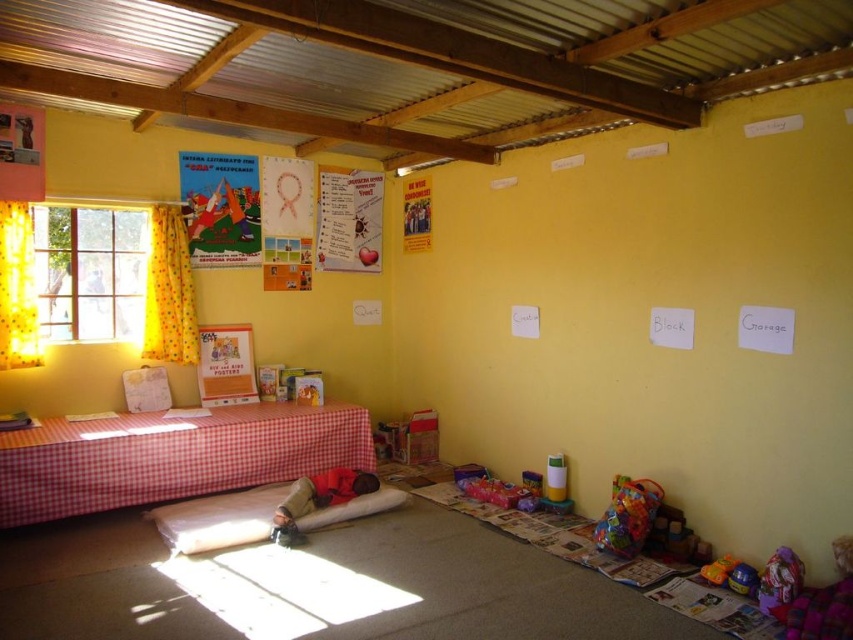
You are standing in the room and want to hang a new poster that is the same size as the taller object between the yellow fabric window at left and the multicolored fabric bag at lower right. Which object should you measure to ensure the poster fits properly?

The yellow fabric window at left is taller than the multicolored fabric bag at lower right, so you should measure the yellow fabric window at left to ensure the poster fits properly.

You are an interior designer planning to hang a new decoration in the room. You have two options for placement. One is next to the yellow fabric window at left, and the other is next to the matte paper poster at upper left. Considering their sizes, which location would allow for a larger decoration?

The yellow fabric window at left is larger in size than the matte paper poster at upper left, so placing the decoration next to the yellow fabric window at left would allow for a larger decoration.